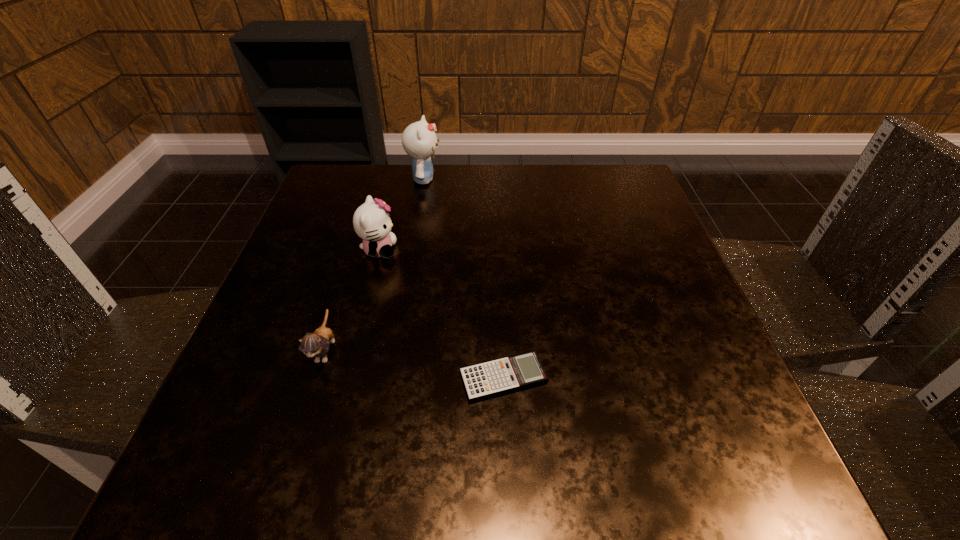
Locate an element on the screen. This screenshot has height=540, width=960. vacant space that's between the shortest object and the nearest kitten is located at coordinates (415, 364).

Identify the location of unoccupied area between the shortest object and the tallest kitten. (464, 279).

Identify the location of free space that is in between the calculator and the tallest object. (464, 279).

The image size is (960, 540). I want to click on free area in between the second nearest kitten and the tallest object, so click(x=401, y=215).

Where is `vacant area that lies between the shortest kitten and the tallest kitten`? This screenshot has width=960, height=540. vacant area that lies between the shortest kitten and the tallest kitten is located at coordinates (374, 265).

I want to click on free point between the second farthest kitten and the rightmost object, so click(442, 314).

Identify the location of free spot between the second tallest object and the farthest kitten. (401, 215).

This screenshot has width=960, height=540. I want to click on vacant region between the third tallest object and the second farthest kitten, so click(x=352, y=300).

Find the location of a particular element. The image size is (960, 540). free spot between the calculator and the second shortest kitten is located at coordinates click(x=442, y=314).

This screenshot has width=960, height=540. Find the location of `object that is the second nearest to the farthest object`. object that is the second nearest to the farthest object is located at coordinates (316, 344).